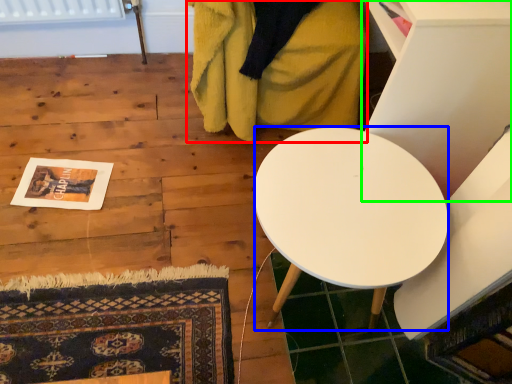
Question: Which is nearer to the blanket (highlighted by a red box)? desk (highlighted by a blue box) or furniture (highlighted by a green box).

Choices:
 (A) desk
 (B) furniture

Answer: (B)